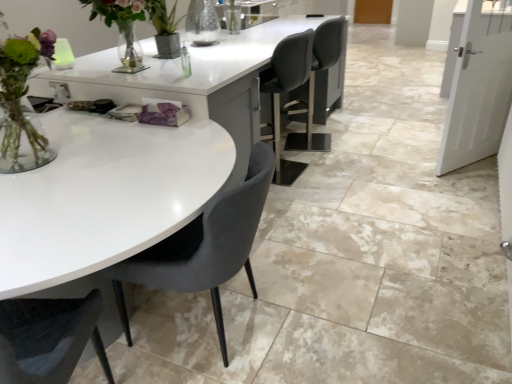
Question: In the image, is velvet grey chair at center positioned in front of or behind white glossy table at center?

Choices:
 (A) front
 (B) behind

Answer: (B)

Question: In the image, is velvet grey chair at center on the left side or the right side of white glossy table at center?

Choices:
 (A) right
 (B) left

Answer: (B)

Question: Do you think velvet grey chair at center is within white glossy table at center, or outside of it?

Choices:
 (A) outside
 (B) inside

Answer: (A)

Question: From a real-world perspective, is white glossy table at center above or below velvet grey chair at center?

Choices:
 (A) above
 (B) below

Answer: (B)

Question: Considering the positions of point [x=88, y=177] and point [x=228, y=236], is point [x=88, y=177] closer or farther from the camera than point [x=228, y=236]?

Choices:
 (A) closer
 (B) farther

Answer: (B)

Question: Relative to velvet grey chair at center, is white glossy table at center in front or behind?

Choices:
 (A) behind
 (B) front

Answer: (B)

Question: Do you think white glossy table at center is within velvet grey chair at center, or outside of it?

Choices:
 (A) outside
 (B) inside

Answer: (A)